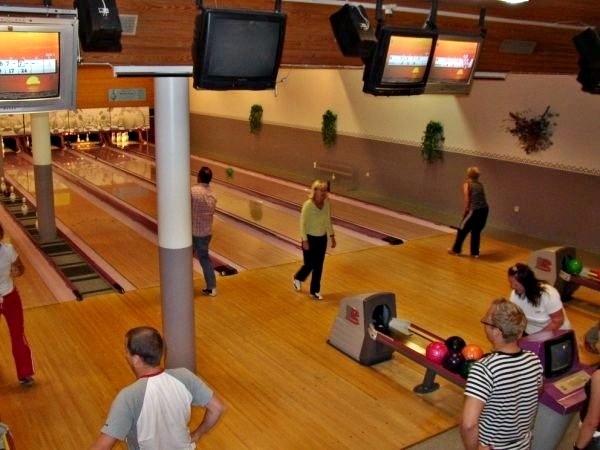
The height and width of the screenshot is (450, 600). What are the coordinates of `tv` in the screenshot? It's located at (31, 68), (249, 45), (403, 57), (464, 61), (589, 73).